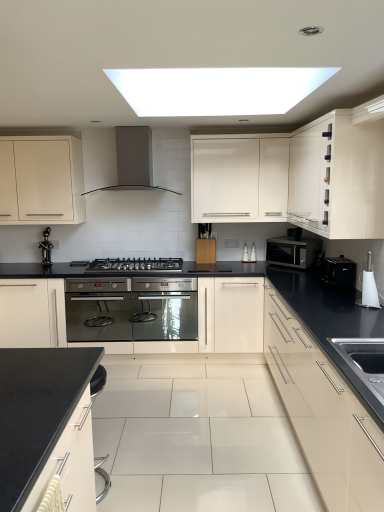
Question: Does white glossy toilet brush at right, positioned as the 1th appliance in front-to-back order, have a greater height compared to black stainless steel gas stove at center?

Choices:
 (A) no
 (B) yes

Answer: (B)

Question: Is white glossy toilet brush at right, positioned as the 1th appliance in front-to-back order, thinner than black stainless steel gas stove at center?

Choices:
 (A) yes
 (B) no

Answer: (A)

Question: Considering the relative positions of white glossy toilet brush at right, placed as the 2th appliance when sorted from back to front, and black stainless steel gas stove at center in the image provided, is white glossy toilet brush at right, placed as the 2th appliance when sorted from back to front, to the right of black stainless steel gas stove at center from the viewer's perspective?

Choices:
 (A) no
 (B) yes

Answer: (B)

Question: Is white glossy toilet brush at right, positioned as the 1th appliance in front-to-back order, looking in the opposite direction of black stainless steel gas stove at center?

Choices:
 (A) no
 (B) yes

Answer: (A)

Question: Does white glossy toilet brush at right, positioned as the 1th appliance in front-to-back order, have a smaller size compared to black stainless steel gas stove at center?

Choices:
 (A) no
 (B) yes

Answer: (B)

Question: Considering the relative positions of white glossy toilet brush at right, positioned as the 1th appliance in front-to-back order, and black stainless steel gas stove at center in the image provided, is white glossy toilet brush at right, positioned as the 1th appliance in front-to-back order, to the left of black stainless steel gas stove at center from the viewer's perspective?

Choices:
 (A) no
 (B) yes

Answer: (A)

Question: From a real-world perspective, is black matte faucet at left positioned over glossy cream cabinet at right, the 4th cabinetry when ordered from left to right, based on gravity?

Choices:
 (A) no
 (B) yes

Answer: (B)

Question: From the image's perspective, is black matte faucet at left on glossy cream cabinet at right, the 4th cabinetry when ordered from left to right?

Choices:
 (A) yes
 (B) no

Answer: (A)

Question: Is black matte faucet at left further to camera compared to glossy cream cabinet at right, which is counted as the 2th cabinetry, starting from the right?

Choices:
 (A) no
 (B) yes

Answer: (B)

Question: Considering the relative sizes of black matte faucet at left and glossy cream cabinet at right, the 4th cabinetry when ordered from left to right, in the image provided, is black matte faucet at left taller than glossy cream cabinet at right, the 4th cabinetry when ordered from left to right,?

Choices:
 (A) no
 (B) yes

Answer: (A)

Question: Can you confirm if black matte faucet at left is positioned to the right of glossy cream cabinet at right, the 4th cabinetry when ordered from left to right?

Choices:
 (A) yes
 (B) no

Answer: (B)

Question: Is black matte faucet at left bigger than glossy cream cabinet at right, the 4th cabinetry when ordered from left to right?

Choices:
 (A) yes
 (B) no

Answer: (B)

Question: Can you confirm if glossy cream cabinet at right, which is counted as the 2th cabinetry, starting from the right, is positioned to the right of white glossy toilet brush at right, placed as the 2th appliance when sorted from back to front?

Choices:
 (A) yes
 (B) no

Answer: (B)